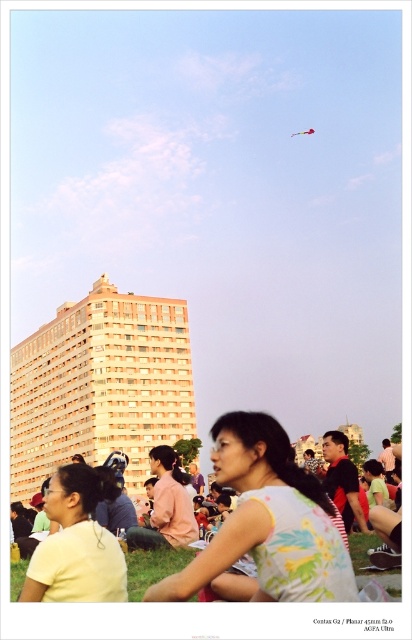
You are standing at the picnic area and want to know how far the point at coordinates (234, 525) is from you. Can you determine the distance?

The distance between the point at coordinates (234, 525) and the viewer is 38.49 meters.

Please provide the 2D coordinates of the floral printed dress at center in the image. The coordinates should be in the format of a tuple with two decimal numbers separated by a comma, enclosed in parentheses. The first number represents the x coordinate, and the second number represents the y coordinate. The coordinate system is normalized, meaning that the origin is at the bottom left corner of the image, and the maximum value for both coordinates is 1.0.

The 2D coordinates of the floral printed dress at center are at point (267, 522).

You are a photographer trying to capture a photo of the multicolored fabric kite at upper center and the floral printed dress at center. Which object should you focus on first if you want to ensure both are in the frame without moving the camera?

You should focus on the floral printed dress at center first because it is larger than the multicolored fabric kite at upper center, making it easier to locate and frame initially.